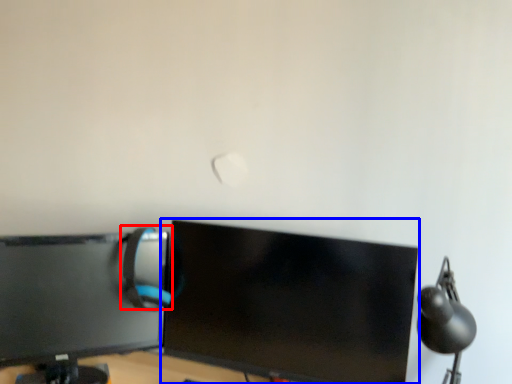
Question: Which point is further to the camera, computer chair (highlighted by a red box) or computer monitor (highlighted by a blue box)?

Choices:
 (A) computer chair
 (B) computer monitor

Answer: (A)